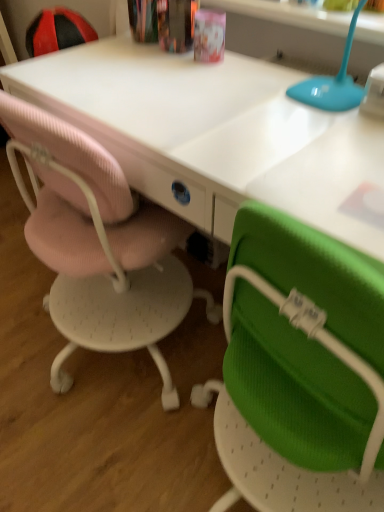
Looking at this image, measure the distance between point (x=93, y=302) and camera.

They are 3.98 feet apart.

Where is `pink mesh chair at left`? Image resolution: width=384 pixels, height=512 pixels. pink mesh chair at left is located at coordinates (99, 247).

In the scene shown: What is the approximate width of pink mesh chair at left?

21.84 inches.

The image size is (384, 512). What do you see at coordinates (99, 247) in the screenshot?
I see `pink mesh chair at left` at bounding box center [99, 247].

The width and height of the screenshot is (384, 512). Find the location of `pink mesh chair at left`. pink mesh chair at left is located at coordinates (99, 247).